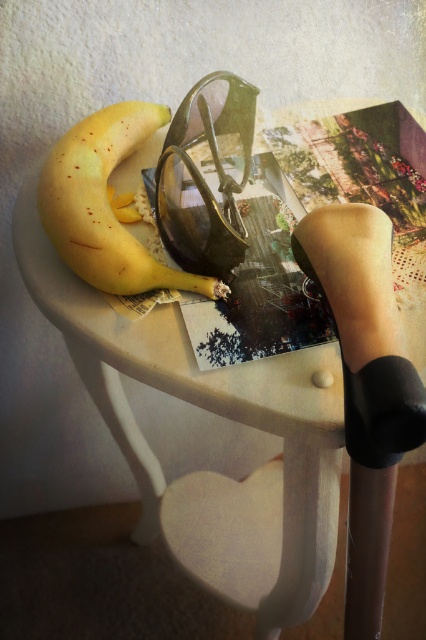
What do you see at coordinates (106, 204) in the screenshot? I see `yellow matte banana at left` at bounding box center [106, 204].

Is yellow matte banana at left to the right of shiny black goggles at center from the viewer's perspective?

In fact, yellow matte banana at left is to the left of shiny black goggles at center.

Find the location of a particular element. yellow matte banana at left is located at coordinates (106, 204).

Where is `yellow matte banana at left`? The height and width of the screenshot is (640, 426). yellow matte banana at left is located at coordinates (106, 204).